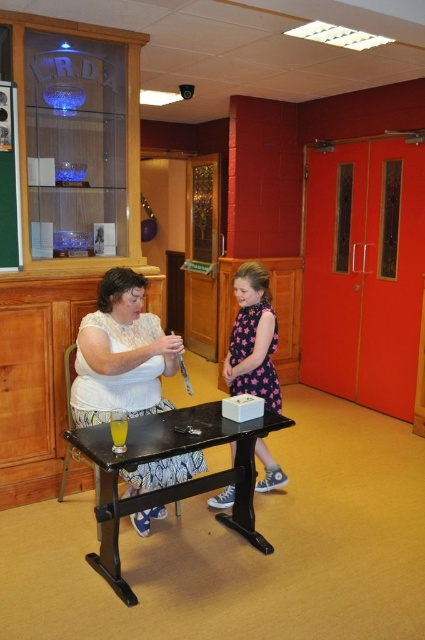
Question: Which object is closer to the camera taking this photo?

Choices:
 (A) pink dotted dress at center
 (B) white matte dress at center
 (C) green matte bulletin board at left

Answer: (B)

Question: Which of the following is the closest to the observer?

Choices:
 (A) (243, 301)
 (B) (2, 100)

Answer: (B)

Question: Is black wood table at center smaller than green matte bulletin board at left?

Choices:
 (A) yes
 (B) no

Answer: (B)

Question: Does white matte dress at center have a greater width compared to black wood table at center?

Choices:
 (A) yes
 (B) no

Answer: (B)

Question: Considering the real-world distances, which object is farthest from the black wood table at center?

Choices:
 (A) green matte bulletin board at left
 (B) white matte dress at center

Answer: (A)

Question: Can you confirm if pink dotted dress at center is positioned to the right of green matte bulletin board at left?

Choices:
 (A) yes
 (B) no

Answer: (A)